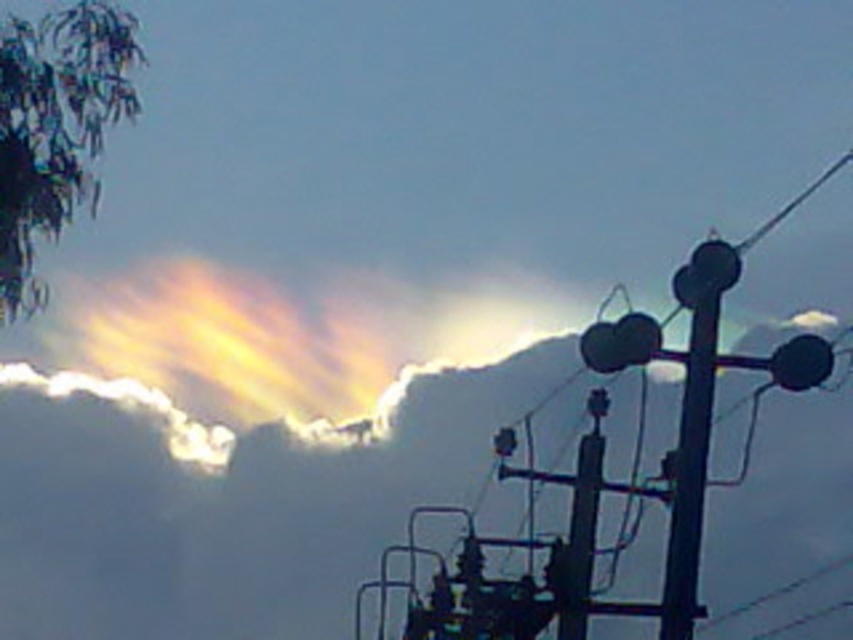
Is black metallic pole at center further to the viewer compared to metallic wire at right?

Yes, it is.

In the scene shown: Does black metallic pole at center appear on the left side of metallic wire at right?

Yes, black metallic pole at center is to the left of metallic wire at right.

Between point (730, 259) and point (805, 582), which one is positioned behind?

Point (805, 582)

You are a GUI agent. You are given a task and a screenshot of the screen. Output one action in this format:
    pyautogui.click(x=<x>, y=<y>)
    Task: Click on the black metallic pole at center
    The height and width of the screenshot is (640, 853).
    Given the screenshot: What is the action you would take?
    pyautogui.click(x=693, y=428)